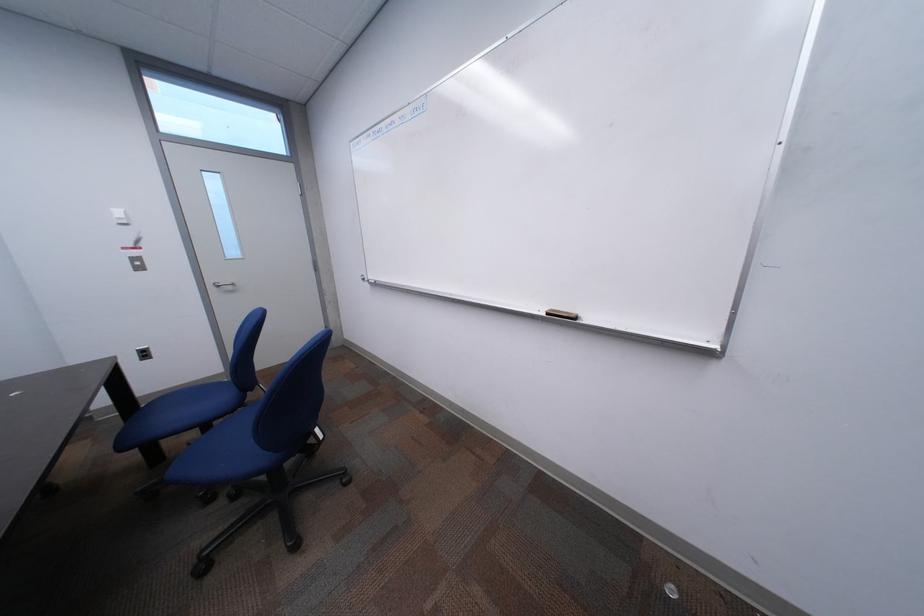
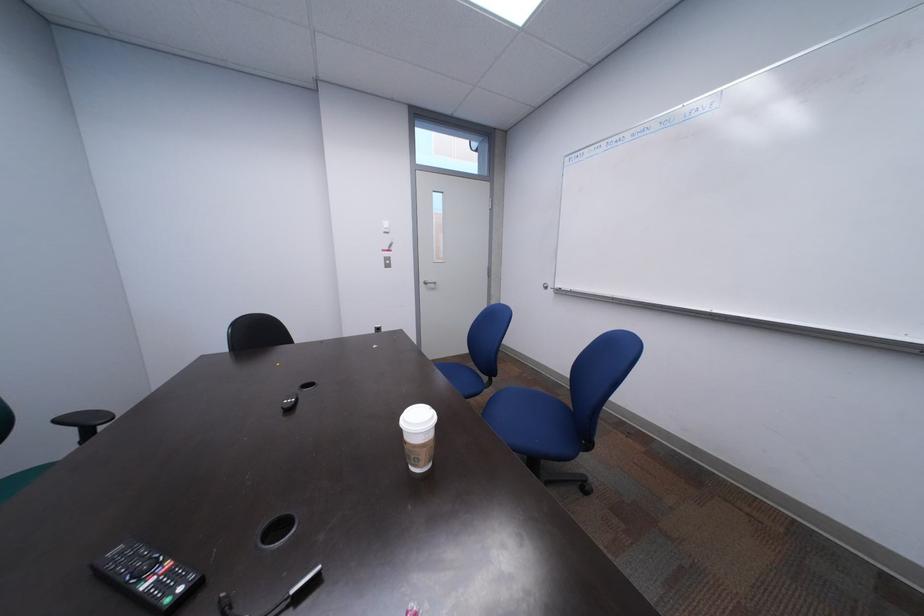
Question: What movement of the cameraman would produce the second image?

Choices:
 (A) Left
 (B) Right
 (C) Forward
 (D) Backward

Answer: (A)